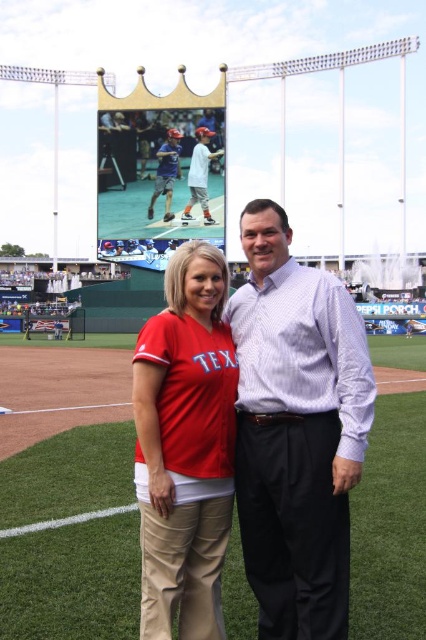
Question: Is matte red jersey at center positioned in front of matte blue shirt at center?

Choices:
 (A) yes
 (B) no

Answer: (A)

Question: Considering the relative positions of matte red jersey at center and matte blue shirt at center in the image provided, where is matte red jersey at center located with respect to matte blue shirt at center?

Choices:
 (A) right
 (B) left

Answer: (A)

Question: Which object is farther from the camera taking this photo?

Choices:
 (A) matte red jersey at center
 (B) light blue shirt at center
 (C) white striped shirt at center
 (D) matte blue shirt at center

Answer: (D)

Question: In this image, where is white striped shirt at center located relative to matte blue shirt at center?

Choices:
 (A) below
 (B) above

Answer: (A)

Question: Estimate the real-world distances between objects in this image. Which object is farther from the matte blue shirt at center?

Choices:
 (A) light blue shirt at center
 (B) white striped shirt at center

Answer: (B)

Question: Which object is the closest to the matte blue shirt at center?

Choices:
 (A) light blue shirt at center
 (B) white striped shirt at center

Answer: (A)